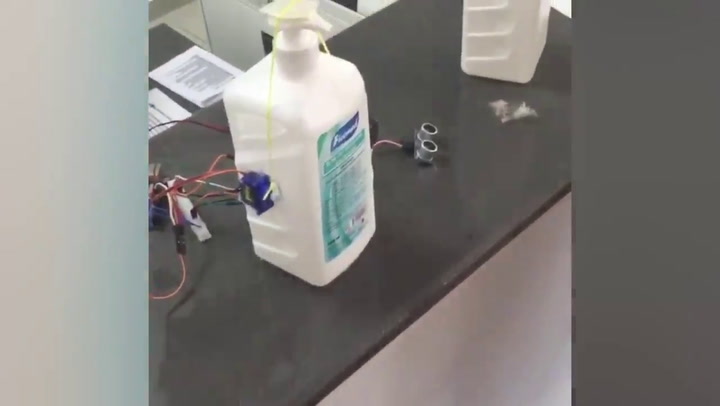
Find the location of a particular element. The image size is (720, 406). counter top is located at coordinates (426, 205).